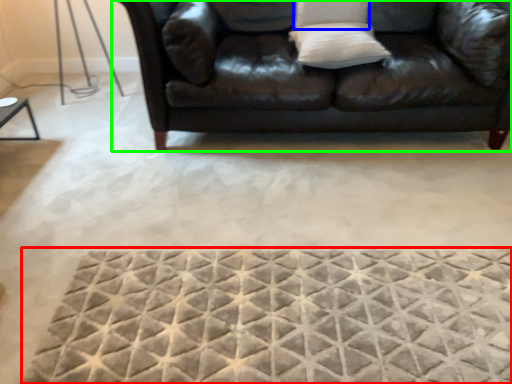
Question: Which object is positioned closest to mat (highlighted by a red box)? Select from pillow (highlighted by a blue box) and studio couch (highlighted by a green box).

Choices:
 (A) pillow
 (B) studio couch

Answer: (B)